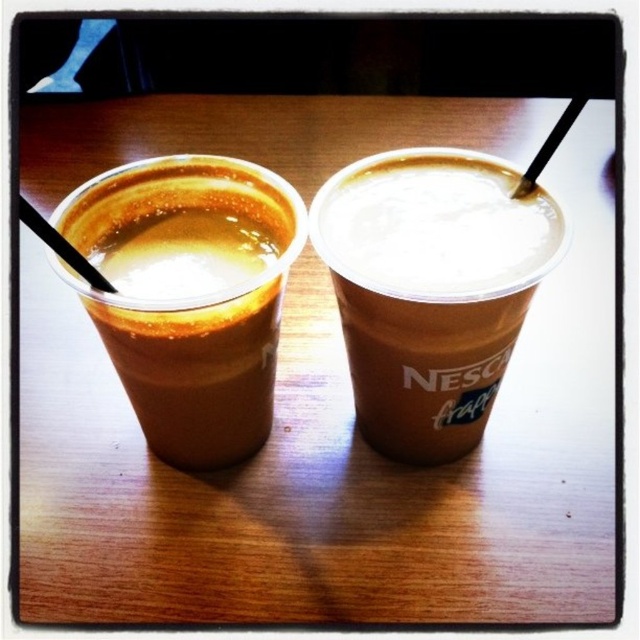
Which is above, white frothy nescafé frappé at center or brown matte cup at left?

white frothy nescafé frappé at center is above.

Does white frothy nescafé frappé at center appear under brown matte cup at left?

Incorrect, white frothy nescafé frappé at center is not positioned below brown matte cup at left.

Does point (316, 234) come closer to viewer compared to point (176, 232)?

Yes, point (316, 234) is closer to viewer.

This screenshot has height=640, width=640. Identify the location of white frothy nescafé frappé at center. (429, 289).

Who is positioned more to the left, brown matte cup at left or black plastic straw at left?

black plastic straw at left is more to the left.

How much distance is there between brown matte cup at left and black plastic straw at left?

brown matte cup at left is 15.55 centimeters from black plastic straw at left.

Which is in front, point (257, 422) or point (49, 243)?

Positioned in front is point (49, 243).

You are a GUI agent. You are given a task and a screenshot of the screen. Output one action in this format:
    pyautogui.click(x=<x>, y=<y>)
    Task: Click on the brown matte cup at left
    
    Given the screenshot: What is the action you would take?
    pyautogui.click(x=189, y=301)

Between point (285, 195) and point (547, 156), which one is positioned behind?

Point (285, 195)

What do you see at coordinates (189, 301) in the screenshot? I see `brown matte cup at left` at bounding box center [189, 301].

Between point (170, 376) and point (541, 161), which one is positioned behind?

Point (541, 161)

Locate an element on the screen. The width and height of the screenshot is (640, 640). brown matte cup at left is located at coordinates (189, 301).